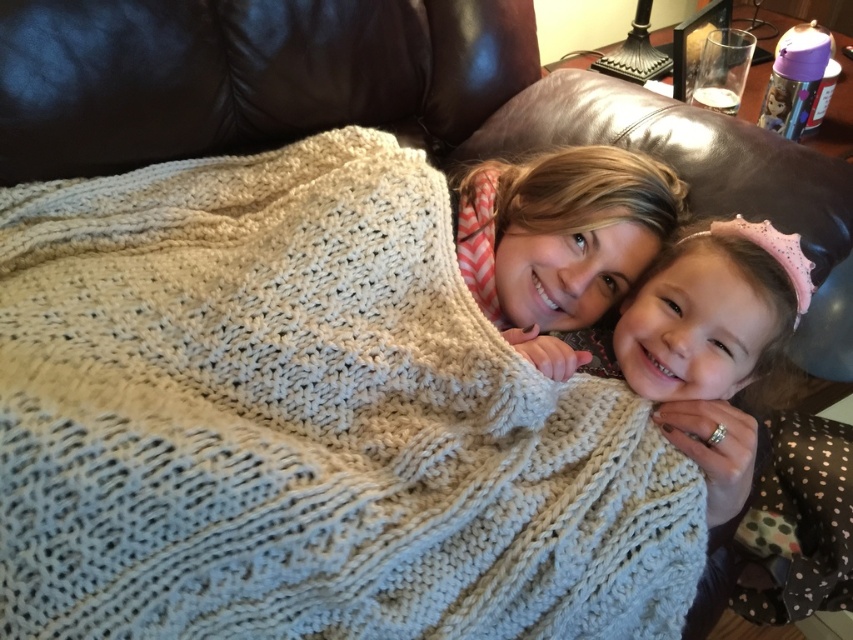
Based on the coordinates provided, where is the polka dot dress at center located in the image?

The polka dot dress at center is located at coordinates point (708, 355).

You are a photographer standing at a distance. You want to take a close up photo of the knitted wool blanket at center without moving any objects. Can you get a close up shot if your camera has a maximum focus distance of 20 inches?

The knitted wool blanket at center is 23.69 inches away from the camera. Since your camera can only focus up to 20 inches, you cannot get a close up photo of the knitted wool blanket at center without moving closer or adjusting the focus distance.

You are a photographer trying to capture the scene. You want to ensure the knitted wool blanket at center and the chevron scarf at center are both in focus. Since the camera can only focus on one object at a time, which object should you focus on to ensure the other is also in focus due to their proximity?

You should focus on the chevron scarf at center because the knitted wool blanket at center is to the left of it, so they are close enough for both to be in focus.